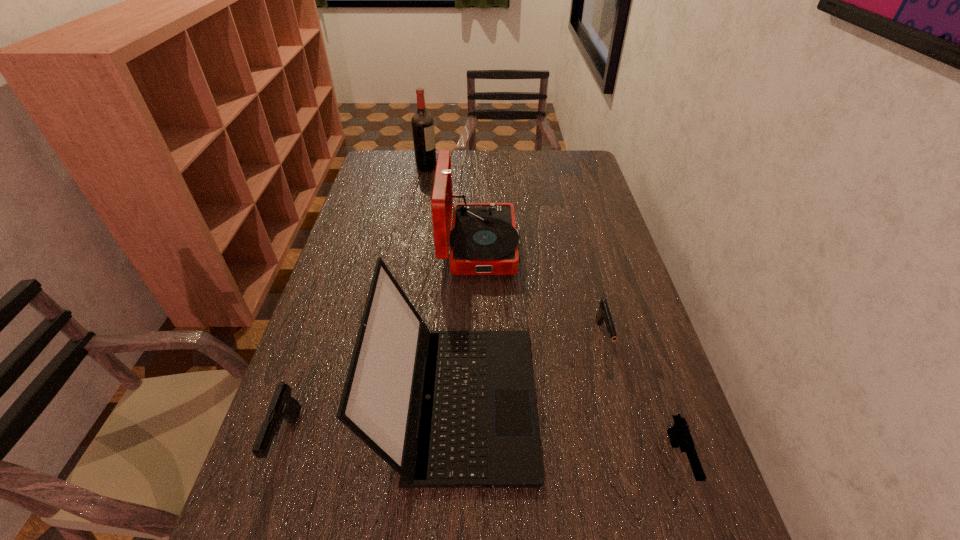
Locate an element on the screen. The height and width of the screenshot is (540, 960). liquor is located at coordinates [x=422, y=122].

The height and width of the screenshot is (540, 960). What are the coordinates of `the second farthest object` in the screenshot? It's located at (484, 240).

This screenshot has width=960, height=540. I want to click on laptop, so coord(445,409).

Where is `the leftmost object`? the leftmost object is located at coordinates (282, 405).

This screenshot has width=960, height=540. Find the location of `the tallest pistol`. the tallest pistol is located at coordinates (282, 405).

Identify the location of the second object from right to left. Image resolution: width=960 pixels, height=540 pixels. (603, 315).

Locate an element on the screen. Image resolution: width=960 pixels, height=540 pixels. the second pistol from left to right is located at coordinates pos(603,315).

Locate an element on the screen. The image size is (960, 540). the rightmost pistol is located at coordinates (679, 434).

At what (x,y) coordinates should I click in order to perform the action: click on free spot located 0.160m on the front-facing side of the liquor. Please return your answer as a coordinate pair (x, y). Image resolution: width=960 pixels, height=540 pixels. Looking at the image, I should click on (477, 167).

This screenshot has height=540, width=960. Identify the location of vacant space positioned on the front-facing side of the phonograph_record. (x=611, y=246).